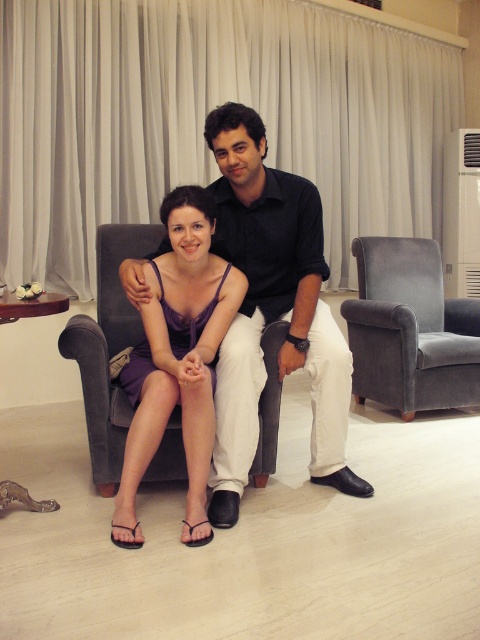
Question: In this image, where is purple satin dress at center located relative to velvet gray armchair at right?

Choices:
 (A) left
 (B) right

Answer: (A)

Question: Which object is the farthest from the black smooth shirt at center?

Choices:
 (A) velvet gray armchair at right
 (B) purple satin dress at center

Answer: (A)

Question: Which object appears farthest from the camera in this image?

Choices:
 (A) velvet gray armchair at right
 (B) purple satin dress at center

Answer: (A)

Question: Which object is the farthest from the velvet gray armchair at right?

Choices:
 (A) purple satin dress at center
 (B) black smooth shirt at center

Answer: (A)

Question: Does black smooth shirt at center appear on the right side of purple satin dress at center?

Choices:
 (A) yes
 (B) no

Answer: (A)

Question: Is black smooth shirt at center above purple satin dress at center?

Choices:
 (A) no
 (B) yes

Answer: (B)